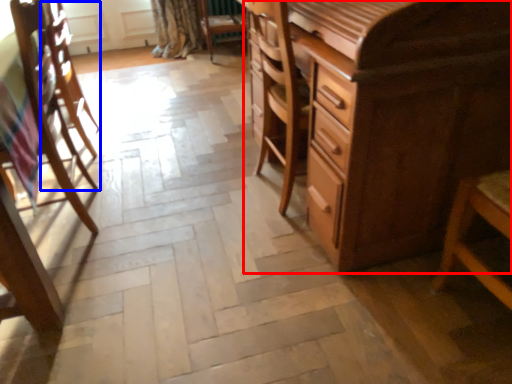
Question: Which point is closer to the camera, chest of drawers (highlighted by a red box) or armchair (highlighted by a blue box)?

Choices:
 (A) chest of drawers
 (B) armchair

Answer: (A)